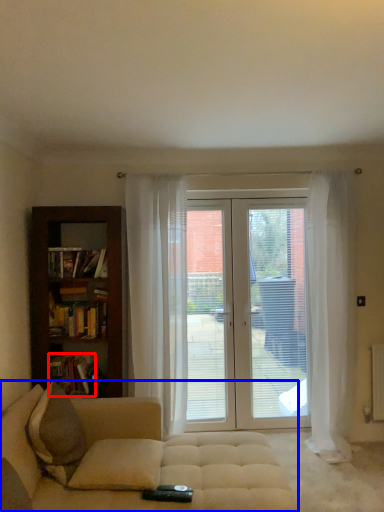
Question: Which of the following is the farthest to the observer, book (highlighted by a red box) or studio couch (highlighted by a blue box)?

Choices:
 (A) book
 (B) studio couch

Answer: (A)